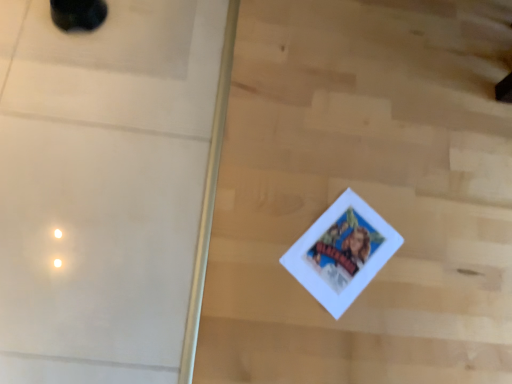
Find the location of a particular element. black rubber shoe at upper left is located at coordinates (78, 14).

Based on the photo, measure the distance between black rubber shoe at upper left and camera.

black rubber shoe at upper left and camera are 1.24 meters apart.

The height and width of the screenshot is (384, 512). What do you see at coordinates (78, 14) in the screenshot?
I see `black rubber shoe at upper left` at bounding box center [78, 14].

The height and width of the screenshot is (384, 512). What do you see at coordinates (108, 188) in the screenshot? I see `white glossy screen door at upper left` at bounding box center [108, 188].

At what (x,y) coordinates should I click in order to perform the action: click on white glossy screen door at upper left. Please return your answer as a coordinate pair (x, y). Looking at the image, I should click on (108, 188).

Locate an element on the screen. The width and height of the screenshot is (512, 384). black rubber shoe at upper left is located at coordinates (78, 14).

Based on the photo, would you say black rubber shoe at upper left is to the left or to the right of white glossy screen door at upper left in the picture?

Clearly, black rubber shoe at upper left is on the left of white glossy screen door at upper left in the image.

Does black rubber shoe at upper left lie in front of white glossy screen door at upper left?

That is False.

Does point (78, 27) come farther from viewer compared to point (150, 249)?

Yes, point (78, 27) is farther from viewer.

From the image's perspective, between black rubber shoe at upper left and white glossy screen door at upper left, which one is located above?

From the image's view, black rubber shoe at upper left is above.

From a real-world perspective, is black rubber shoe at upper left below white glossy screen door at upper left?

No, from a real-world perspective, black rubber shoe at upper left is not below white glossy screen door at upper left.

Which object is thinner, black rubber shoe at upper left or white glossy screen door at upper left?

black rubber shoe at upper left is thinner.

Between black rubber shoe at upper left and white glossy screen door at upper left, which one has less height?

Result: Standing shorter between the two is white glossy screen door at upper left.

Looking at the image, does black rubber shoe at upper left seem bigger or smaller compared to white glossy screen door at upper left?

Clearly, black rubber shoe at upper left is smaller in size than white glossy screen door at upper left.

Is black rubber shoe at upper left situated inside white glossy screen door at upper left or outside?

black rubber shoe at upper left is located beyond the bounds of white glossy screen door at upper left.

Based on the photo, is black rubber shoe at upper left beside white glossy screen door at upper left?

There is a gap between black rubber shoe at upper left and white glossy screen door at upper left.

Based on the photo, could you tell me if black rubber shoe at upper left is turned towards white glossy screen door at upper left?

Yes, black rubber shoe at upper left is aimed at white glossy screen door at upper left.

How different are the orientations of black rubber shoe at upper left and white glossy screen door at upper left in degrees?

They differ by 92.2 degrees in their facing directions.

Identify the location of footwear above the white glossy screen door at upper left (from a real-world perspective). (78, 14).

Which object is positioned more to the left, white glossy screen door at upper left or black rubber shoe at upper left?

black rubber shoe at upper left.

Considering the relative positions of white glossy screen door at upper left and black rubber shoe at upper left in the image provided, is white glossy screen door at upper left behind black rubber shoe at upper left?

No, it is in front of black rubber shoe at upper left.

Which is nearer, (143, 317) or (90, 13)?

Point (143, 317) is positioned closer to the camera compared to point (90, 13).

From the picture: From the image's perspective, is white glossy screen door at upper left on black rubber shoe at upper left?

No, from the image's perspective, white glossy screen door at upper left is not above black rubber shoe at upper left.

From a real-world perspective, which object stands above the other?

black rubber shoe at upper left.

Which of these two, white glossy screen door at upper left or black rubber shoe at upper left, is thinner?

With smaller width is black rubber shoe at upper left.

Who is taller, white glossy screen door at upper left or black rubber shoe at upper left?

black rubber shoe at upper left.

Who is bigger, white glossy screen door at upper left or black rubber shoe at upper left?

With larger size is white glossy screen door at upper left.

Is black rubber shoe at upper left a part of white glossy screen door at upper left?

Actually, black rubber shoe at upper left is outside white glossy screen door at upper left.

From the picture: Is white glossy screen door at upper left in contact with black rubber shoe at upper left?

No, white glossy screen door at upper left is not with black rubber shoe at upper left.

Is white glossy screen door at upper left turned away from black rubber shoe at upper left?

No, white glossy screen door at upper left is not facing the opposite direction of black rubber shoe at upper left.

How many degrees apart are the facing directions of white glossy screen door at upper left and black rubber shoe at upper left?

white glossy screen door at upper left and black rubber shoe at upper left are facing 92.2 degrees away from each other.

Find the location of a particular element. Image resolution: width=512 pixels, height=384 pixels. screen door below the black rubber shoe at upper left (from the image's perspective) is located at coordinates (108, 188).

At what (x,y) coordinates should I click in order to perform the action: click on screen door directly beneath the black rubber shoe at upper left (from a real-world perspective). Please return your answer as a coordinate pair (x, y). This screenshot has height=384, width=512. Looking at the image, I should click on (108, 188).

Where is `screen door lying below the black rubber shoe at upper left (from the image's perspective)`? screen door lying below the black rubber shoe at upper left (from the image's perspective) is located at coordinates (108, 188).